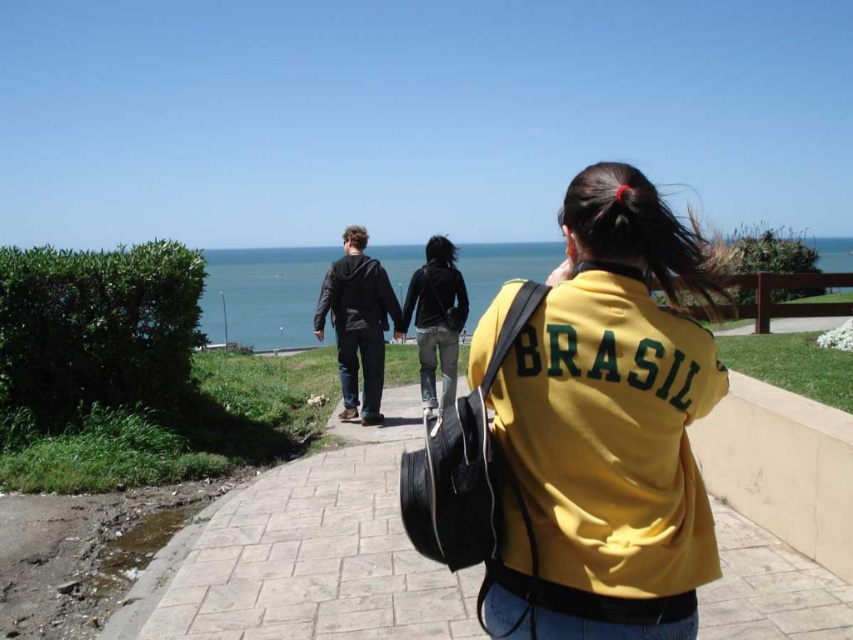
Question: Which object is closer to the camera taking this photo?

Choices:
 (A) yellow fabric jacket at center
 (B) black cotton hoodie at center

Answer: (A)

Question: Where is paved stone pavement at center located in relation to black cotton hoodie at center in the image?

Choices:
 (A) above
 (B) below

Answer: (B)

Question: Does paved stone pavement at center lie in front of black cotton hoodie at center?

Choices:
 (A) yes
 (B) no

Answer: (A)

Question: Can you confirm if dark gray hoodie at center is wider than black cotton hoodie at center?

Choices:
 (A) no
 (B) yes

Answer: (B)

Question: Which object appears farthest from the camera in this image?

Choices:
 (A) black cotton hoodie at center
 (B) blue water at center

Answer: (B)

Question: Which of these objects is positioned farthest from the yellow fabric jacket at center?

Choices:
 (A) blue water at center
 (B) dark gray hoodie at center

Answer: (A)